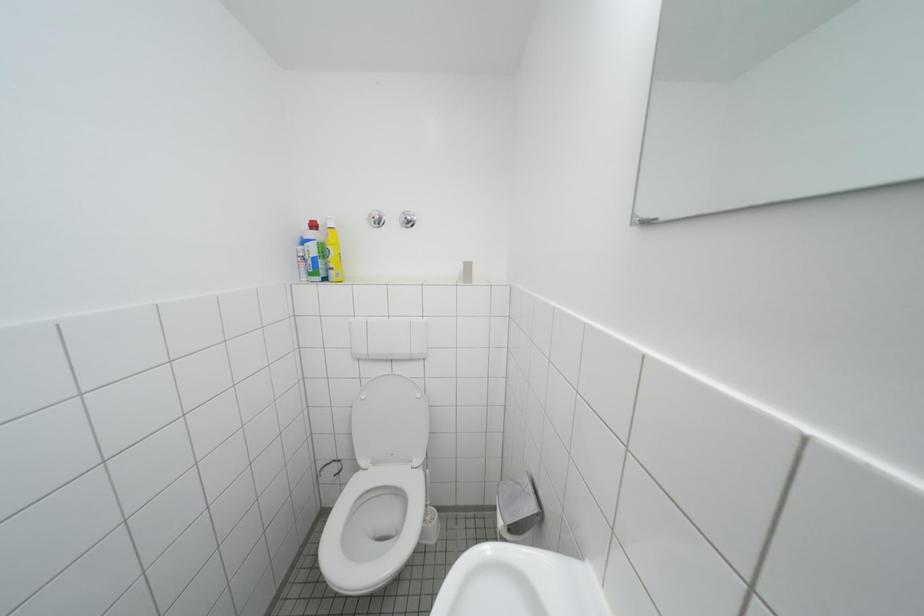
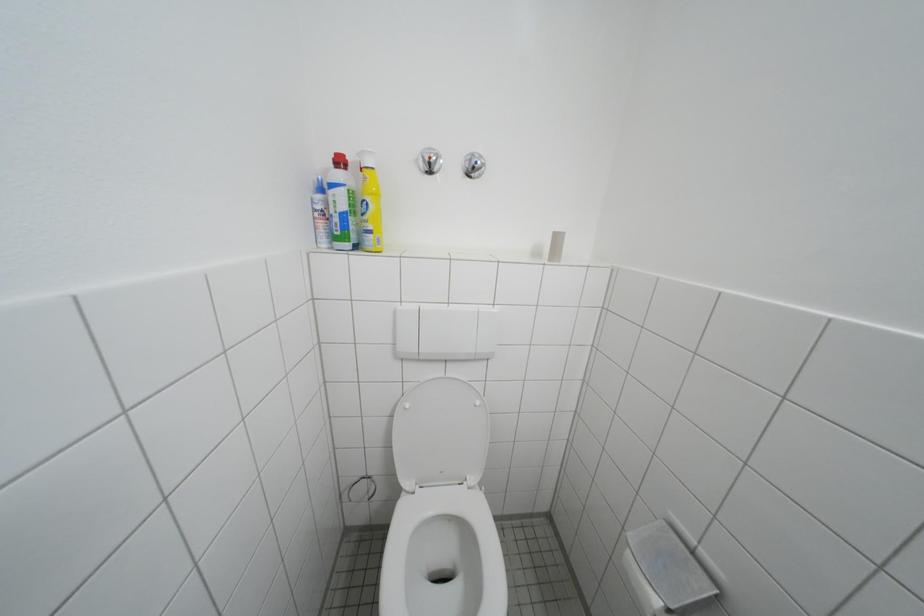
Question: Based on the continuous images, in which direction is the camera rotating? Reply with the corresponding letter.

Choices:
 (A) Left
 (B) Right
 (C) Up
 (D) Down

Answer: (D)